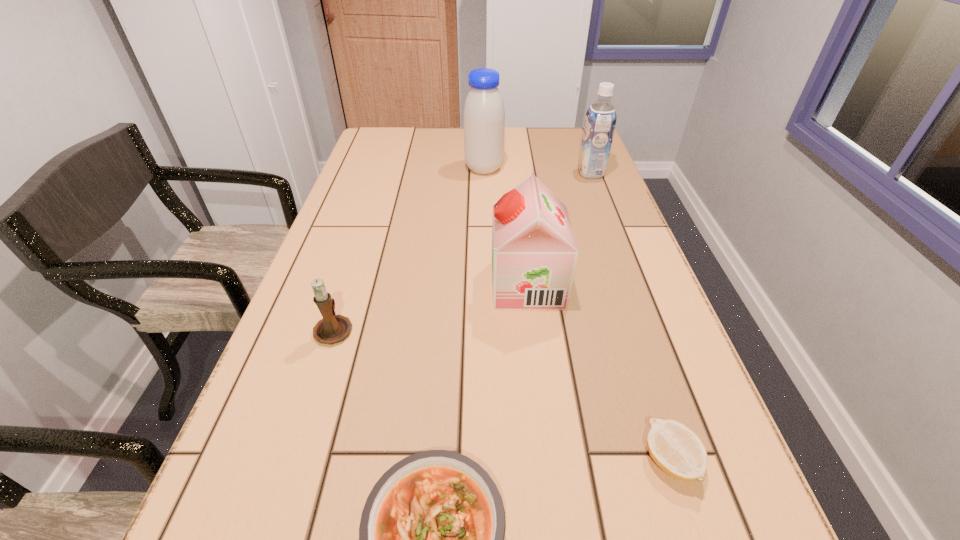
You are a GUI agent. You are given a task and a screenshot of the screen. Output one action in this format:
    pyautogui.click(x=<x>, y=<y>)
    Task: Click on the free space located with the cap open on the third farthest object
    
    Given the screenshot: What is the action you would take?
    pyautogui.click(x=405, y=285)

What are the coordinates of `free location located 0.120m on the side of the candle holder with the handle` in the screenshot? It's located at (352, 273).

Where is `free space located 0.100m on the side of the candle holder with the handle`? Image resolution: width=960 pixels, height=540 pixels. free space located 0.100m on the side of the candle holder with the handle is located at coordinates (350, 279).

Identify the location of vacant space situated on the side of the candle holder with the handle. (355, 264).

Identify the location of vacant space situated 0.050m on the left of the lemon. The height and width of the screenshot is (540, 960). (611, 461).

Find the location of a particular element. The image size is (960, 540). object that is at the left edge is located at coordinates (332, 328).

Where is `soya milk that is positioned at the right edge`? This screenshot has height=540, width=960. soya milk that is positioned at the right edge is located at coordinates (600, 121).

You are a GUI agent. You are given a task and a screenshot of the screen. Output one action in this format:
    pyautogui.click(x=<x>, y=<y>)
    Task: Click on the lemon at the right edge
    The width and height of the screenshot is (960, 540).
    Given the screenshot: What is the action you would take?
    pyautogui.click(x=677, y=450)

You are a GUI agent. You are given a task and a screenshot of the screen. Output one action in this format:
    pyautogui.click(x=<x>, y=<y>)
    Task: Click on the vacant region at the far edge of the desktop
    
    Given the screenshot: What is the action you would take?
    pyautogui.click(x=537, y=130)

Find the location of `free space at the left edge of the desktop`. free space at the left edge of the desktop is located at coordinates (290, 537).